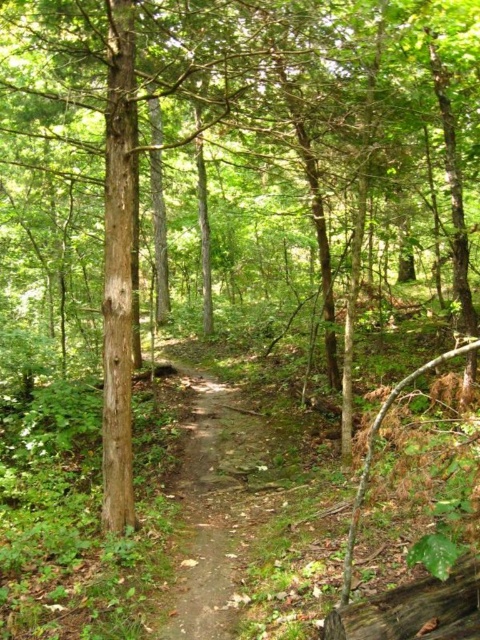
You are a hiker carrying a backpack and need to cross from the dirt path at center to the brown rough log at lower right. Given that your backpack has a width of 2 feet, can you safely move sideways between them without hitting either side?

The dirt path at center and brown rough log at lower right are 6.38 feet apart. Subtracting the backpack width of 2 feet, there is still 4.38 feet of space remaining, which is more than enough for safe sideways movement. Yes, you can safely move between them.

As you walk along the dirt path at center in the forest, you notice a brown rough log at lower right. Which direction should you turn to face the log?

You should turn to your right because the dirt path at center is to the left of the brown rough log at lower right, meaning the log is positioned to the right side of the path from your perspective as you walk along it.

You are standing at the point with coordinates (x=211, y=509) in the forest scene. What is located at this specific coordinate point?

The dirt path at center is located at point (x=211, y=509).